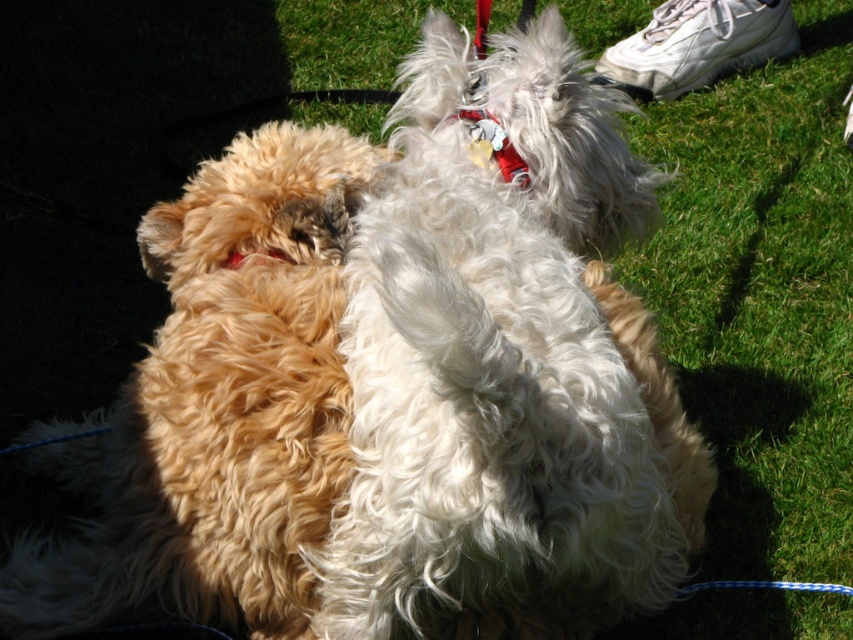
In the scene shown: Is fluffy golden fur at center above red fabric neckband at center?

No, fluffy golden fur at center is not above red fabric neckband at center.

Is fluffy golden fur at center to the left of red fabric neckband at center from the viewer's perspective?

Yes, fluffy golden fur at center is to the left of red fabric neckband at center.

Who is more forward, [187,500] or [480,148]?

Positioned in front is point [187,500].

The width and height of the screenshot is (853, 640). In order to click on fluffy golden fur at center in this screenshot , I will do `click(216, 408)`.

Does red fabric neckband at center appear on the left side of red fabric collar at center?

Incorrect, red fabric neckband at center is not on the left side of red fabric collar at center.

Is point (489, 157) positioned in front of point (286, 257)?

No, (489, 157) is further to viewer.

Where is `red fabric neckband at center`? This screenshot has width=853, height=640. red fabric neckband at center is located at coordinates coord(492,145).

Is fluffy golden fur at center in front of red fabric collar at center?

Yes, it is.

Which is more to the right, fluffy golden fur at center or red fabric collar at center?

red fabric collar at center is more to the right.

Find the location of a particular element. fluffy golden fur at center is located at coordinates coord(216,408).